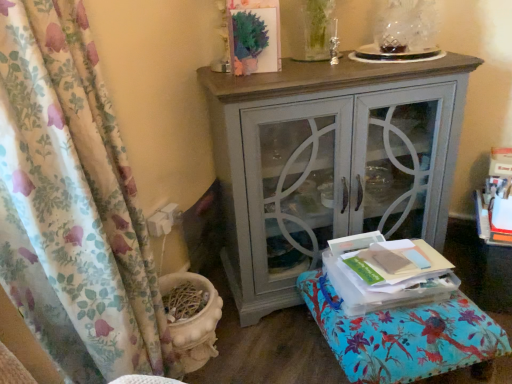
Question: Considering the relative sizes of matte gray cabinet at center and floral fabric curtain at left in the image provided, is matte gray cabinet at center wider than floral fabric curtain at left?

Choices:
 (A) yes
 (B) no

Answer: (A)

Question: Are matte gray cabinet at center and floral fabric curtain at left far apart?

Choices:
 (A) yes
 (B) no

Answer: (B)

Question: Does matte gray cabinet at center appear on the right side of floral fabric curtain at left?

Choices:
 (A) no
 (B) yes

Answer: (B)

Question: Is matte gray cabinet at center located outside floral fabric curtain at left?

Choices:
 (A) no
 (B) yes

Answer: (B)

Question: Is matte gray cabinet at center positioned with its back to floral fabric curtain at left?

Choices:
 (A) no
 (B) yes

Answer: (A)

Question: From the image's perspective, is floral fabric curtain at left positioned above or below floral fabric ottoman at lower right?

Choices:
 (A) below
 (B) above

Answer: (B)

Question: Is point (95, 51) positioned closer to the camera than point (307, 279)?

Choices:
 (A) farther
 (B) closer

Answer: (B)

Question: From their relative heights in the image, would you say floral fabric curtain at left is taller or shorter than floral fabric ottoman at lower right?

Choices:
 (A) short
 (B) tall

Answer: (B)

Question: Is floral fabric curtain at left situated inside floral fabric ottoman at lower right or outside?

Choices:
 (A) inside
 (B) outside

Answer: (B)

Question: In terms of height, does floral fabric curtain at left look taller or shorter compared to matte gray cabinet at center?

Choices:
 (A) short
 (B) tall

Answer: (B)

Question: From a real-world perspective, relative to matte gray cabinet at center, is floral fabric curtain at left vertically above or below?

Choices:
 (A) above
 (B) below

Answer: (A)

Question: Would you say floral fabric curtain at left is to the left or to the right of matte gray cabinet at center in the picture?

Choices:
 (A) left
 (B) right

Answer: (A)

Question: Considering the positions of floral fabric curtain at left and matte gray cabinet at center in the image, is floral fabric curtain at left wider or thinner than matte gray cabinet at center?

Choices:
 (A) wide
 (B) thin

Answer: (B)

Question: Is floral fabric ottoman at lower right taller or shorter than matte gray cabinet at center?

Choices:
 (A) short
 (B) tall

Answer: (A)

Question: Considering the positions of point (478, 317) and point (245, 236), is point (478, 317) closer or farther from the camera than point (245, 236)?

Choices:
 (A) farther
 (B) closer

Answer: (B)